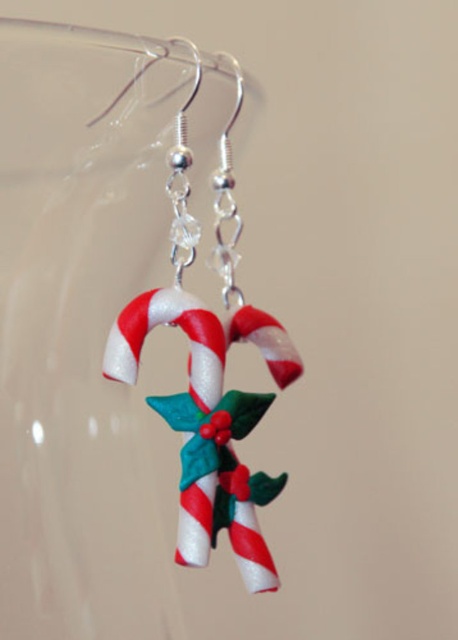
You are a gift wrapper and need to place the shiny plastic candy cane at center into the transparent glass vase at center. Will the candy cane fit vertically inside the vase?

The transparent glass vase at center has a greater height compared to shiny plastic candy cane at center, so yes, the candy cane will fit vertically inside the vase since the vase is taller than the candy cane.